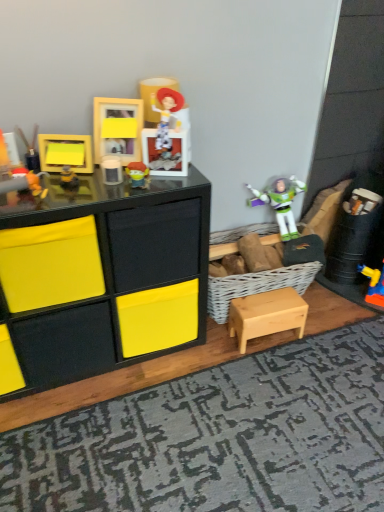
At what (x,y) coordinates should I click in order to perform the action: click on free space in front of matte yellow frame at upper left, which appears as the fourth toy when viewed from the left. Please return your answer as a coordinate pair (x, y). This screenshot has height=512, width=384. Looking at the image, I should click on (59, 198).